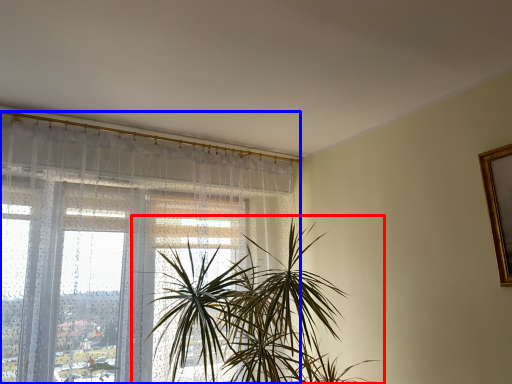
Question: Which object is further to the camera taking this photo, houseplant (highlighted by a red box) or window (highlighted by a blue box)?

Choices:
 (A) houseplant
 (B) window

Answer: (B)